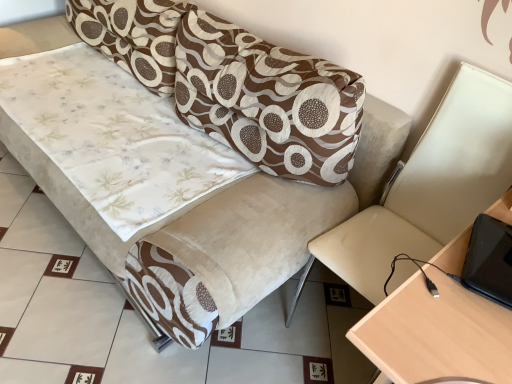
Question: Based on their sizes in the image, would you say brown textured pillow at upper center is bigger or smaller than beige leather swivel chair at right?

Choices:
 (A) small
 (B) big

Answer: (A)

Question: Relative to beige leather swivel chair at right, is brown textured pillow at upper center in front or behind?

Choices:
 (A) behind
 (B) front

Answer: (A)

Question: Estimate the real-world distances between objects in this image. Which object is farther from the velvet-like beige couch at center?

Choices:
 (A) brown textured pillow at upper center
 (B) light wood table at right
 (C) beige leather swivel chair at right

Answer: (B)

Question: Estimate the real-world distances between objects in this image. Which object is farther from the brown textured pillow at upper center?

Choices:
 (A) velvet-like beige couch at center
 (B) light wood table at right
 (C) beige leather swivel chair at right

Answer: (B)